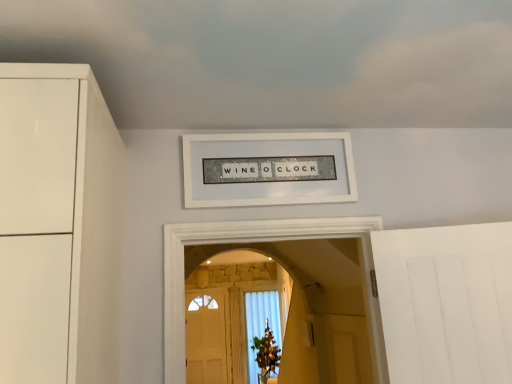
Question: Can you confirm if white matte cloud at upper center is smaller than white glittery sign at center?

Choices:
 (A) yes
 (B) no

Answer: (B)

Question: Is white matte cloud at upper center at the right side of white glittery sign at center?

Choices:
 (A) yes
 (B) no

Answer: (A)

Question: From the image's perspective, does white matte cloud at upper center appear lower than white glittery sign at center?

Choices:
 (A) no
 (B) yes

Answer: (A)

Question: Can you confirm if white matte cloud at upper center is taller than white glittery sign at center?

Choices:
 (A) yes
 (B) no

Answer: (B)

Question: Can you confirm if white matte cloud at upper center is thinner than white glittery sign at center?

Choices:
 (A) yes
 (B) no

Answer: (B)

Question: From the image's perspective, does white matte cloud at upper center appear higher than white glittery sign at center?

Choices:
 (A) no
 (B) yes

Answer: (B)

Question: Can you confirm if white glittery sign at center is taller than white matte cloud at upper center?

Choices:
 (A) no
 (B) yes

Answer: (B)

Question: From the image's perspective, is white glittery sign at center on top of white matte cloud at upper center?

Choices:
 (A) no
 (B) yes

Answer: (A)

Question: Considering the relative positions of white glittery sign at center and white matte cloud at upper center in the image provided, is white glittery sign at center to the right of white matte cloud at upper center from the viewer's perspective?

Choices:
 (A) no
 (B) yes

Answer: (A)

Question: Is white glittery sign at center positioned beyond the bounds of white matte cloud at upper center?

Choices:
 (A) no
 (B) yes

Answer: (B)

Question: Is white glittery sign at center positioned behind white matte cloud at upper center?

Choices:
 (A) yes
 (B) no

Answer: (A)

Question: Is white glittery sign at center placed right next to white matte cloud at upper center?

Choices:
 (A) no
 (B) yes

Answer: (A)

Question: Considering the positions of white matte cloud at upper center and white glittery sign at center in the image, is white matte cloud at upper center wider or thinner than white glittery sign at center?

Choices:
 (A) wide
 (B) thin

Answer: (A)